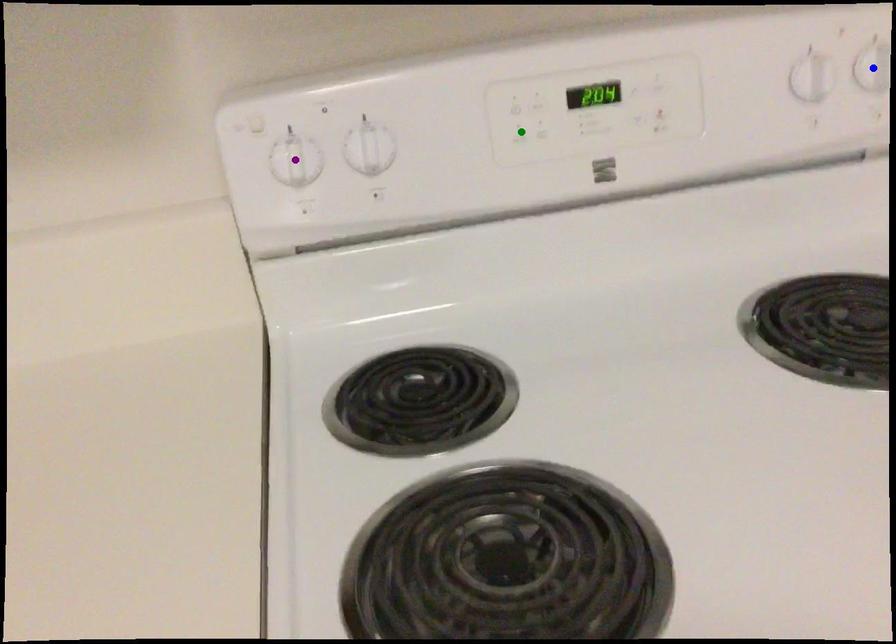
Looking at this image, order these from nearest to farthest:
- blue point
- green point
- purple point

blue point, green point, purple point